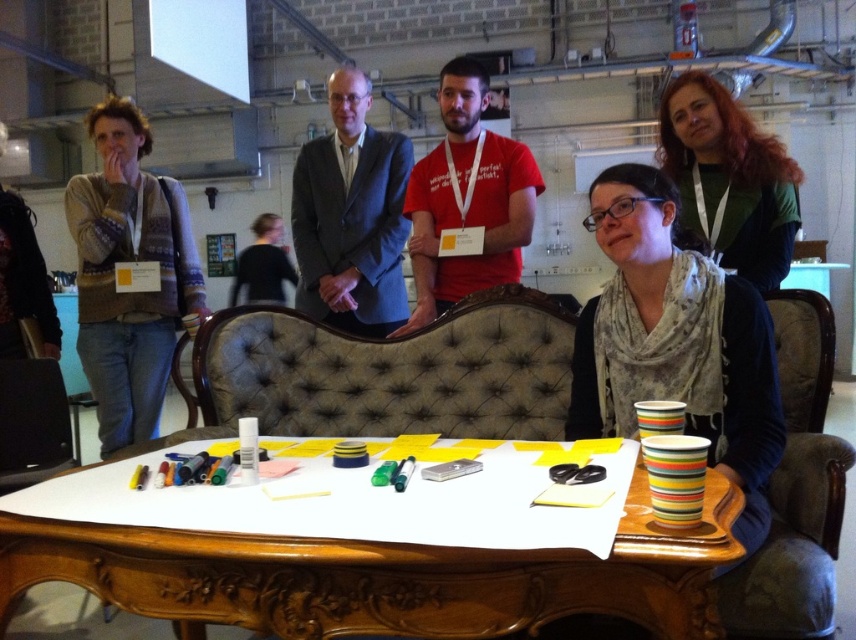
You are standing at the camera position and want to reach point (116, 257). Is the distance less than 3 meters?

The distance of point (116, 257) from camera is 2.65 meters, so yes, it is less than 3 meters.

You are observing a group of people around a table in an indoor setting. There are two points marked on the image at coordinates point (797, 616) and point (354, 232). From your perspective, which of these two points is nearer to you?

Point (797, 616) is closer to the camera than point (354, 232), so the point at coordinates point (797, 616) is nearer to you.